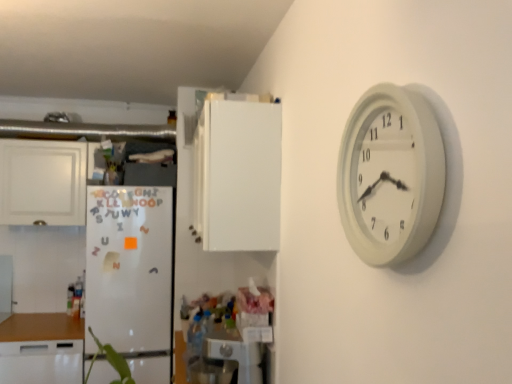
Question: Does metallic silver appliance at lower center have a lesser height compared to white matte refrigerator at left?

Choices:
 (A) yes
 (B) no

Answer: (A)

Question: Can you confirm if metallic silver appliance at lower center is wider than white matte refrigerator at left?

Choices:
 (A) yes
 (B) no

Answer: (B)

Question: Considering the relative positions of metallic silver appliance at lower center and white matte refrigerator at left in the image provided, is metallic silver appliance at lower center to the left of white matte refrigerator at left from the viewer's perspective?

Choices:
 (A) yes
 (B) no

Answer: (B)

Question: Is metallic silver appliance at lower center located outside white matte refrigerator at left?

Choices:
 (A) no
 (B) yes

Answer: (B)

Question: Would you say white matte refrigerator at left is part of metallic silver appliance at lower center's contents?

Choices:
 (A) yes
 (B) no

Answer: (B)

Question: From the image's perspective, does metallic silver appliance at lower center appear lower than white matte refrigerator at left?

Choices:
 (A) yes
 (B) no

Answer: (A)

Question: Does white matte cabinet at left, marked as the 2th cabinetry in a front-to-back arrangement, appear on the left side of white matte refrigerator at left?

Choices:
 (A) yes
 (B) no

Answer: (A)

Question: Does white matte cabinet at left, the 1th cabinetry in the left-to-right sequence, come in front of white matte refrigerator at left?

Choices:
 (A) no
 (B) yes

Answer: (A)

Question: Can you confirm if white matte cabinet at left, marked as the 2th cabinetry in a front-to-back arrangement, is smaller than white matte refrigerator at left?

Choices:
 (A) yes
 (B) no

Answer: (A)

Question: Is white matte cabinet at left, which is the first cabinetry from back to front, positioned far away from white matte refrigerator at left?

Choices:
 (A) yes
 (B) no

Answer: (B)

Question: Is white matte cabinet at left, the 1th cabinetry in the left-to-right sequence, turned away from white matte refrigerator at left?

Choices:
 (A) yes
 (B) no

Answer: (B)

Question: Is white matte cabinet at left, the 1th cabinetry in the left-to-right sequence, positioned behind white matte refrigerator at left?

Choices:
 (A) no
 (B) yes

Answer: (B)

Question: Can you confirm if white matte refrigerator at left is taller than white matte cabinet at left, which is the first cabinetry from back to front?

Choices:
 (A) yes
 (B) no

Answer: (A)